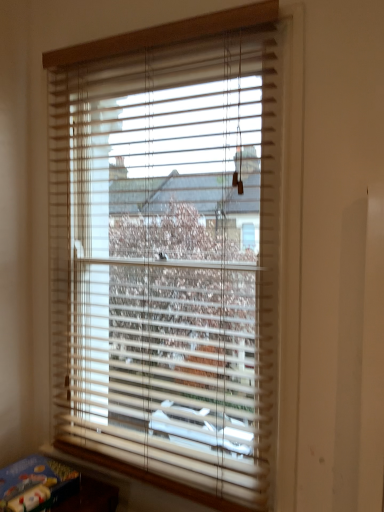
Question: Is wooden blinds at center outside blue cardboard book at lower left?

Choices:
 (A) no
 (B) yes

Answer: (B)

Question: Is wooden blinds at center oriented away from blue cardboard book at lower left?

Choices:
 (A) no
 (B) yes

Answer: (A)

Question: Is wooden blinds at center smaller than blue cardboard book at lower left?

Choices:
 (A) yes
 (B) no

Answer: (B)

Question: Is wooden blinds at center bigger than blue cardboard book at lower left?

Choices:
 (A) yes
 (B) no

Answer: (A)

Question: Does wooden blinds at center come behind blue cardboard book at lower left?

Choices:
 (A) yes
 (B) no

Answer: (B)

Question: Could you tell me if wooden blinds at center is facing blue cardboard book at lower left?

Choices:
 (A) yes
 (B) no

Answer: (A)

Question: Is blue cardboard book at lower left positioned with its back to wooden blinds at center?

Choices:
 (A) yes
 (B) no

Answer: (B)

Question: Is blue cardboard book at lower left bigger than wooden blinds at center?

Choices:
 (A) yes
 (B) no

Answer: (B)

Question: Is blue cardboard book at lower left next to wooden blinds at center and touching it?

Choices:
 (A) no
 (B) yes

Answer: (A)

Question: Considering the relative sizes of blue cardboard book at lower left and wooden blinds at center in the image provided, is blue cardboard book at lower left shorter than wooden blinds at center?

Choices:
 (A) no
 (B) yes

Answer: (B)

Question: Is blue cardboard book at lower left in front of wooden blinds at center?

Choices:
 (A) yes
 (B) no

Answer: (B)

Question: Considering the relative positions of blue cardboard book at lower left and wooden blinds at center in the image provided, is blue cardboard book at lower left to the right of wooden blinds at center from the viewer's perspective?

Choices:
 (A) yes
 (B) no

Answer: (B)

Question: From a real-world perspective, is wooden blinds at center above or below blue cardboard book at lower left?

Choices:
 (A) below
 (B) above

Answer: (B)